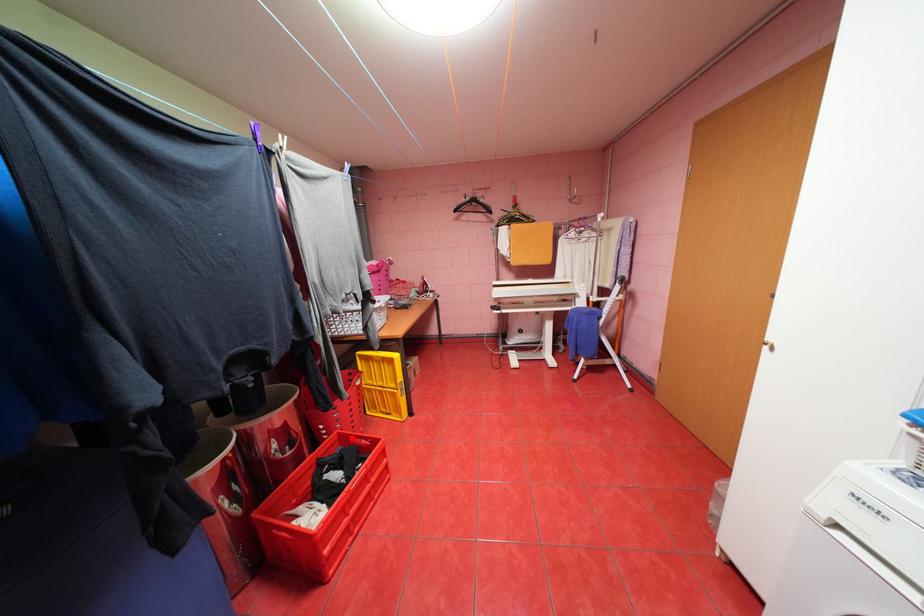
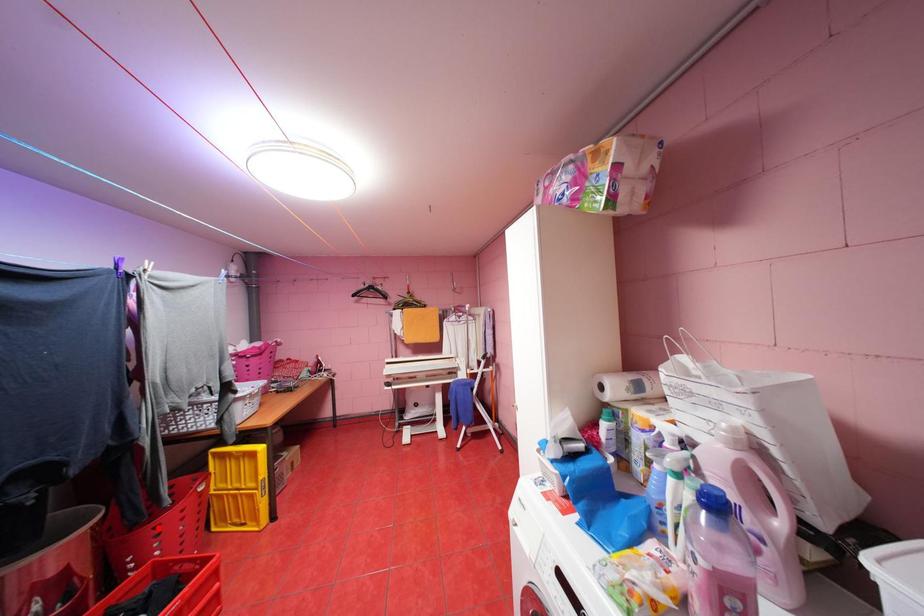
I am providing you with two images of the same scene from different viewpoints. A red point is marked on the first image and another point is marked on the second image. Are the points marked in image1 and image2 representing the same 3D position?

No